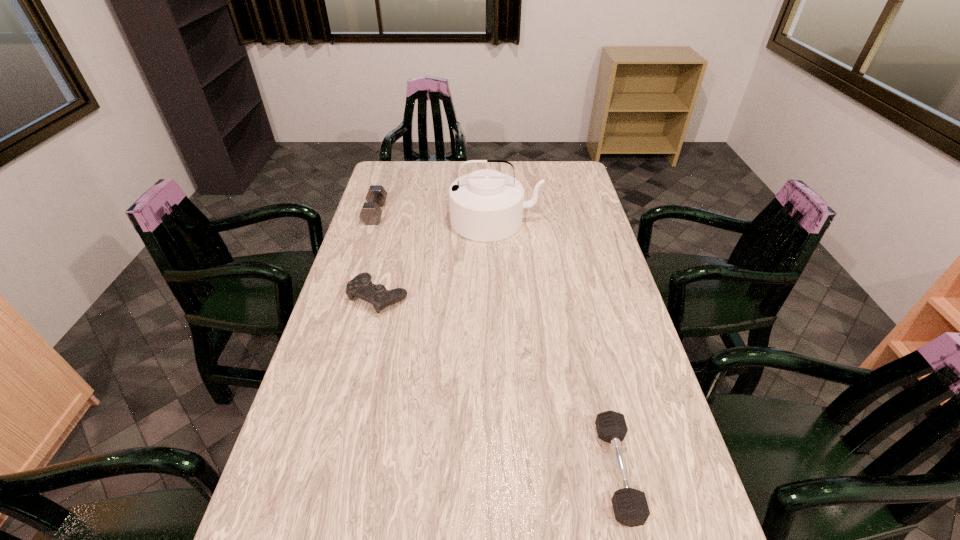
Identify the location of vacant space that satisfies the following two spatial constraints: 1. on the spout of the rightmost object; 2. on the left side of the kettle. (506, 471).

Find the location of a particular element. This screenshot has width=960, height=540. free space that satisfies the following two spatial constraints: 1. on the front side of the third farthest object; 2. on the left side of the rightmost object is located at coordinates (336, 471).